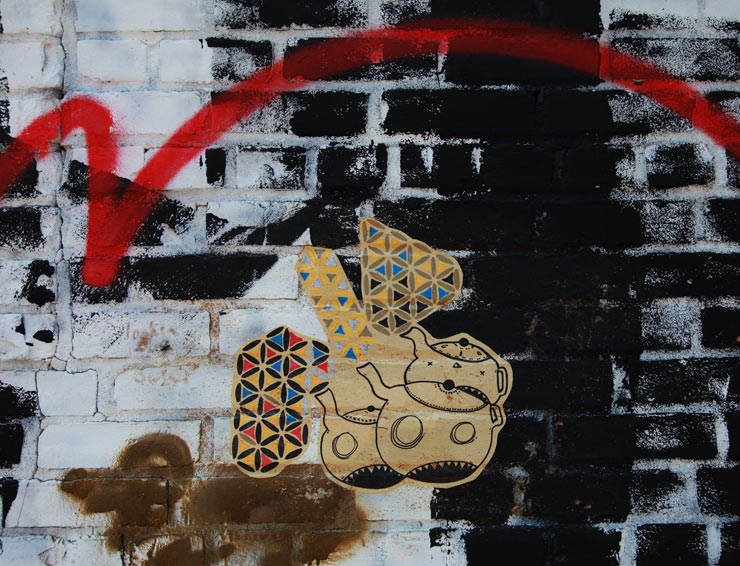
Identify the location of darkest part of wall. (533, 222).